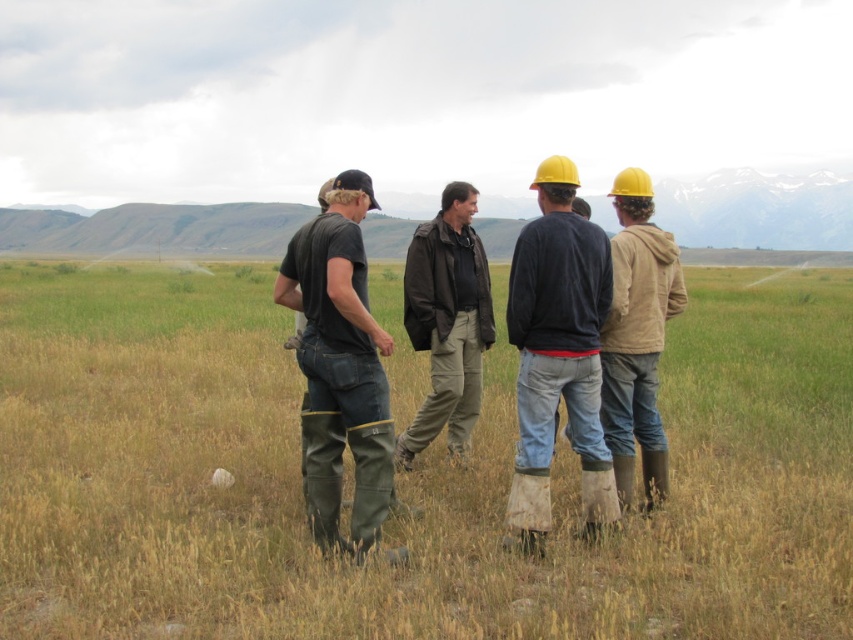
You are a drone operator trying to capture a photo of the green grassy at center and dark green rubber boots at center. Which object should you focus on if you want to ensure both are fully visible in the frame without cropping?

You should focus on the green grassy at center because it is wider than the dark green rubber boots at center, allowing both to fit within the frame without cropping.

You are a photographer standing at the edge of the field. You want to take a photo that includes both the matte black jacket at center and the tan fabric jacket at right. Based on their positions, which jacket will appear closer to the camera in the photo?

The matte black jacket at center appears closer to the camera because it is positioned in front of the tan fabric jacket at right.

You are a photographer standing in the field and want to take a photo that includes both the green grassy at center and the dark brown leather jacket at center. Which object will appear larger in the photo?

The green grassy at center will appear larger in the photo because it is closer to the viewer than the dark brown leather jacket at center.